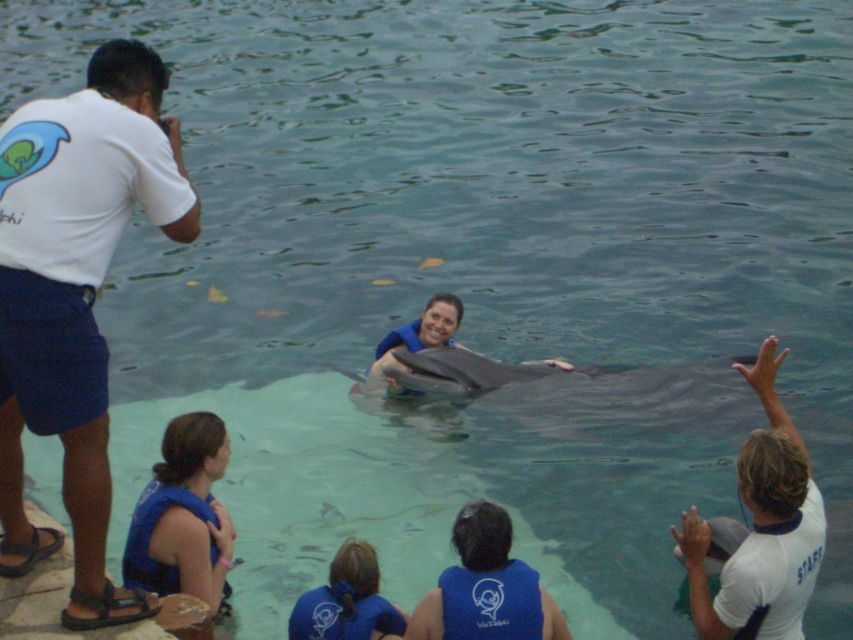
Does blue life vest at lower left have a larger size compared to gray smooth dolphin at center?

Incorrect, blue life vest at lower left is not larger than gray smooth dolphin at center.

Does point (193, 456) come closer to viewer compared to point (474, 394)?

Yes, it is in front of point (474, 394).

Image resolution: width=853 pixels, height=640 pixels. In order to click on blue life vest at lower left in this screenshot , I will do `click(183, 515)`.

Does white matte shirt at upper right have a greater height compared to gray smooth dolphin at center?

Yes, white matte shirt at upper right is taller than gray smooth dolphin at center.

Measure the distance between white matte shirt at upper right and camera.

white matte shirt at upper right is 11.94 meters from camera.

Does point (764, 536) come behind point (430, 364)?

No, (764, 536) is closer to viewer.

I want to click on white matte shirt at upper right, so click(759, 529).

The height and width of the screenshot is (640, 853). Identify the location of white t-shirt at left. (76, 296).

Who is higher up, white t-shirt at left or white matte shirt at upper right?

white t-shirt at left is higher up.

Is point (36, 168) closer to camera compared to point (733, 554)?

Yes.

This screenshot has width=853, height=640. Identify the location of white t-shirt at left. (76, 296).